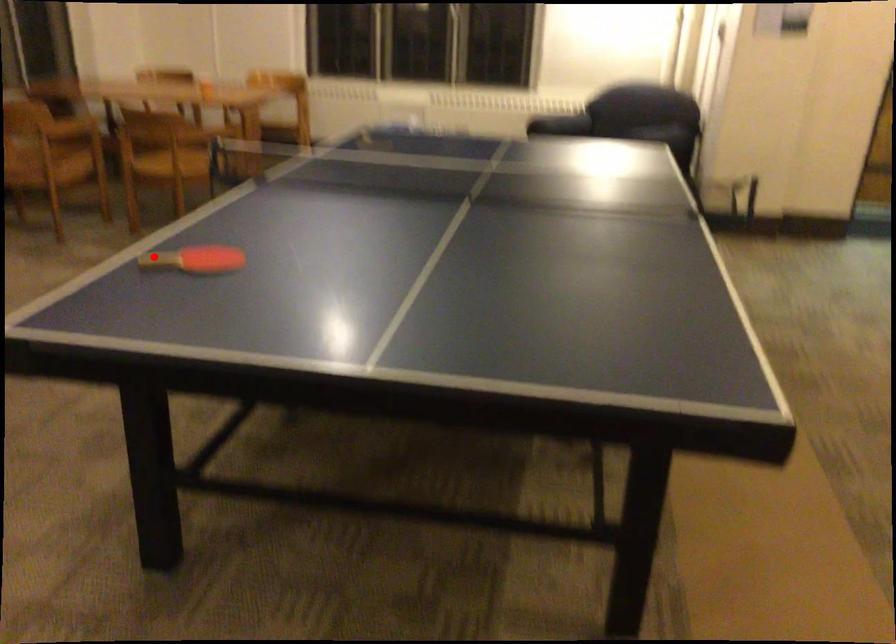
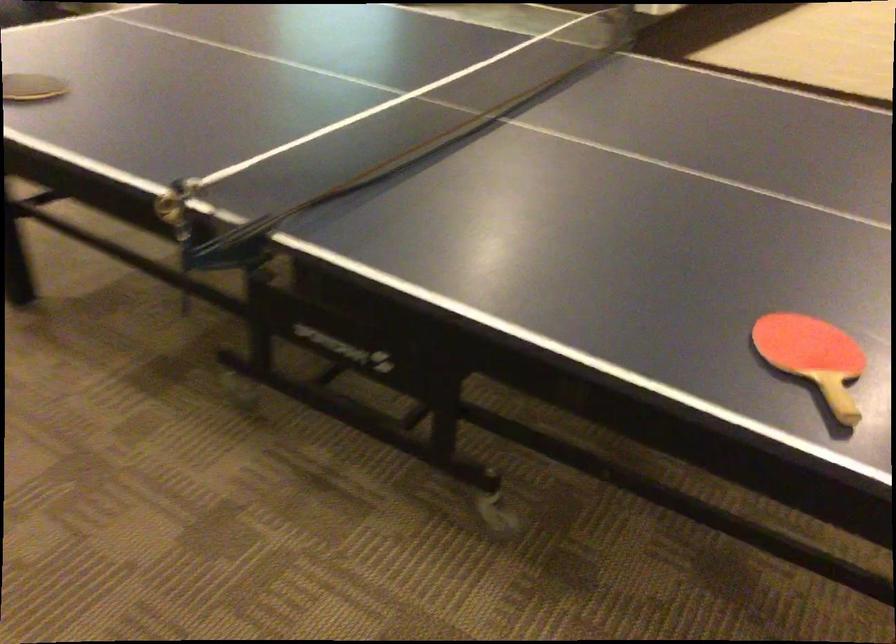
Question: I am providing you with two images of the same scene from different viewpoints. Image1 has a red point marked. In image2, the corresponding 3D location appears at what relative position? Reply with the corresponding letter.

Choices:
 (A) Closer
 (B) Farther

Answer: (A)